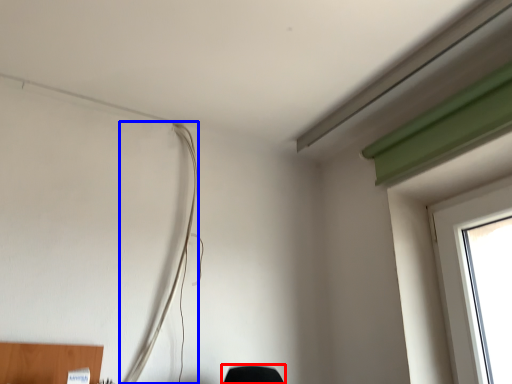
Question: Among these objects, which one is nearest to the camera, furniture (highlighted by a red box) or wire (highlighted by a blue box)?

Choices:
 (A) furniture
 (B) wire

Answer: (A)